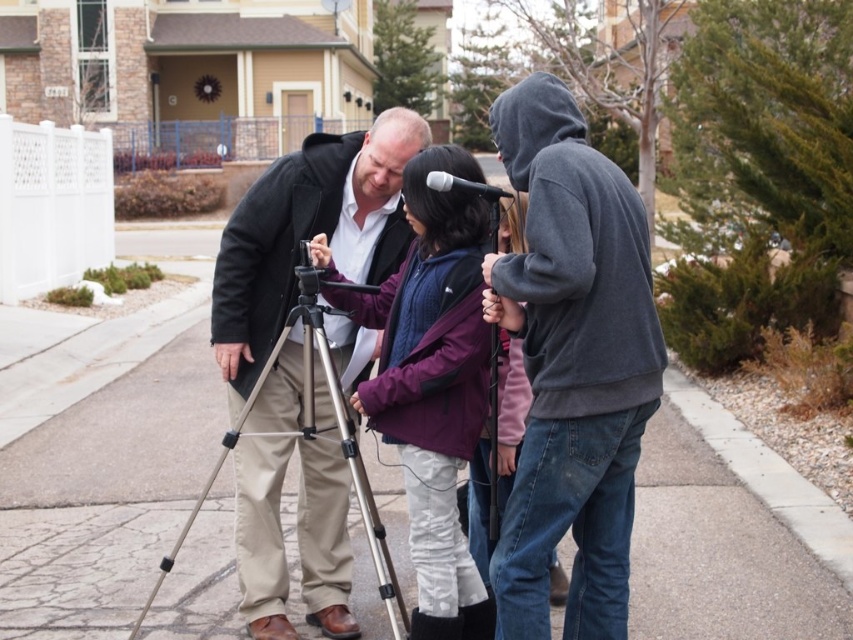
You are standing in front of the camera setup in the residential area. There are two points marked in the scene. Which point, point 1 at coordinates (392, 609) or point 2 at coordinates (849, 532), is closer to you?

Point 1 at coordinates (392, 609) is closer to the viewer than point 2 at coordinates (849, 532).

Based on the photo, you are standing at point (x=517, y=244) and want to walk towards point (x=691, y=520). Is there a clear path between these two points?

Yes, there is a clear path between point (x=691, y=520) and point (x=517, y=244) because the description states that point (x=691, y=520) is behind point (x=517, y=244), implying no obstruction between them.